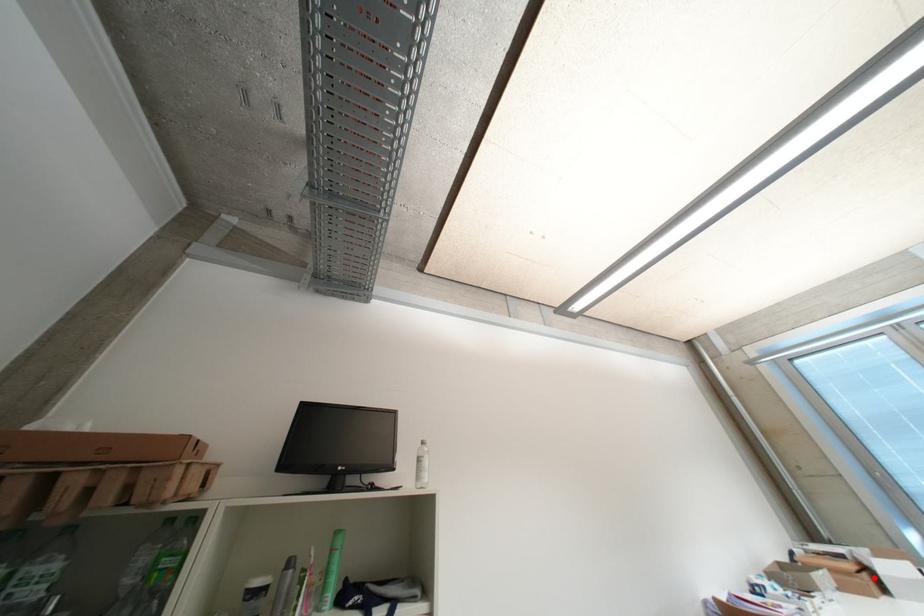
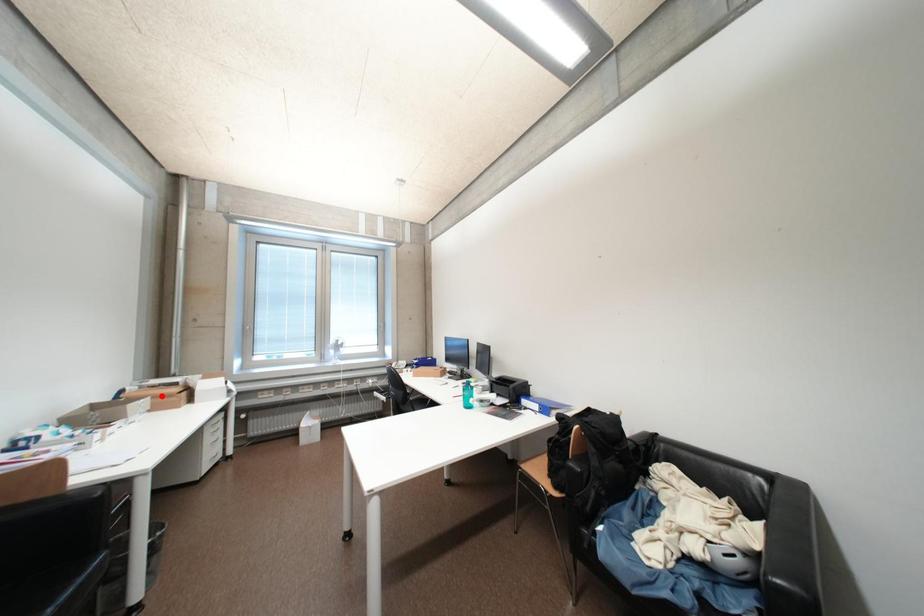
I am providing you with two images of the same scene from different viewpoints. A red point is marked on the first image and another point is marked on the second image. Are the points marked in image1 and image2 representing the same 3D position?

No